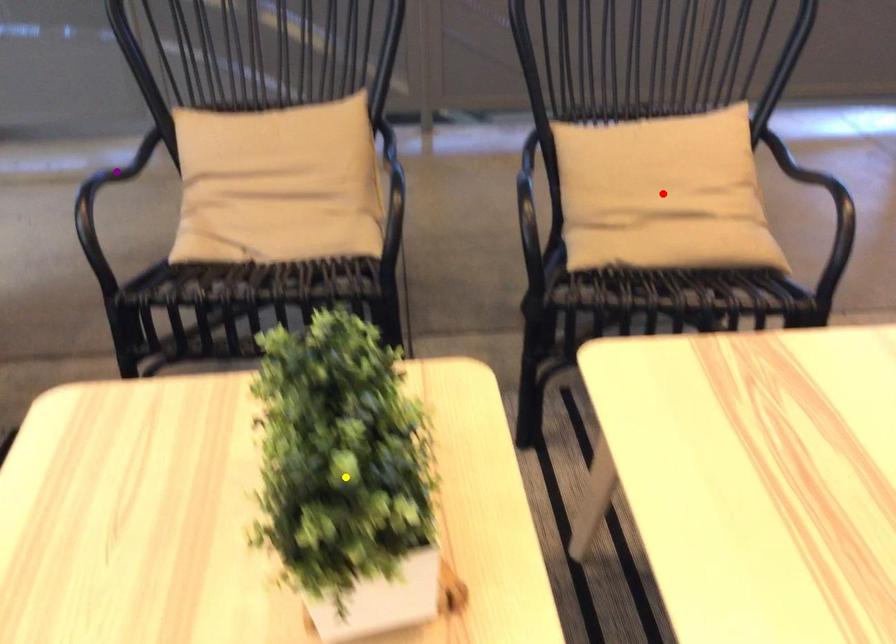
Order these from nearest to farthest:
1. purple point
2. yellow point
3. red point

yellow point → red point → purple point